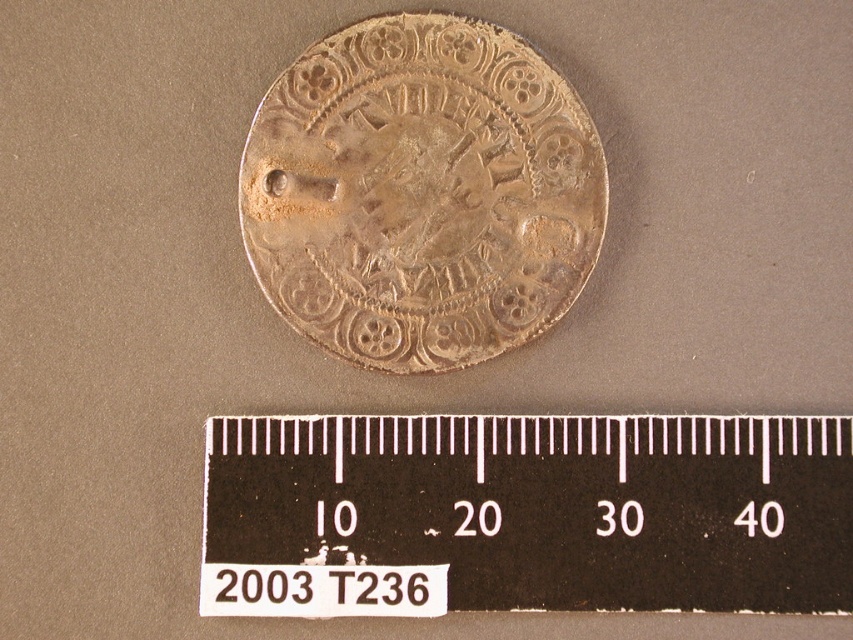
Does black plastic ruler at center have a lesser height compared to gold-toned metallic coin at center?

Indeed, black plastic ruler at center has a lesser height compared to gold-toned metallic coin at center.

Between black plastic ruler at center and gold-toned metallic coin at center, which one has more height?

With more height is gold-toned metallic coin at center.

This screenshot has width=853, height=640. What are the coordinates of `black plastic ruler at center` in the screenshot? It's located at (526, 515).

Where is `black plastic ruler at center`? This screenshot has width=853, height=640. black plastic ruler at center is located at coordinates (526, 515).